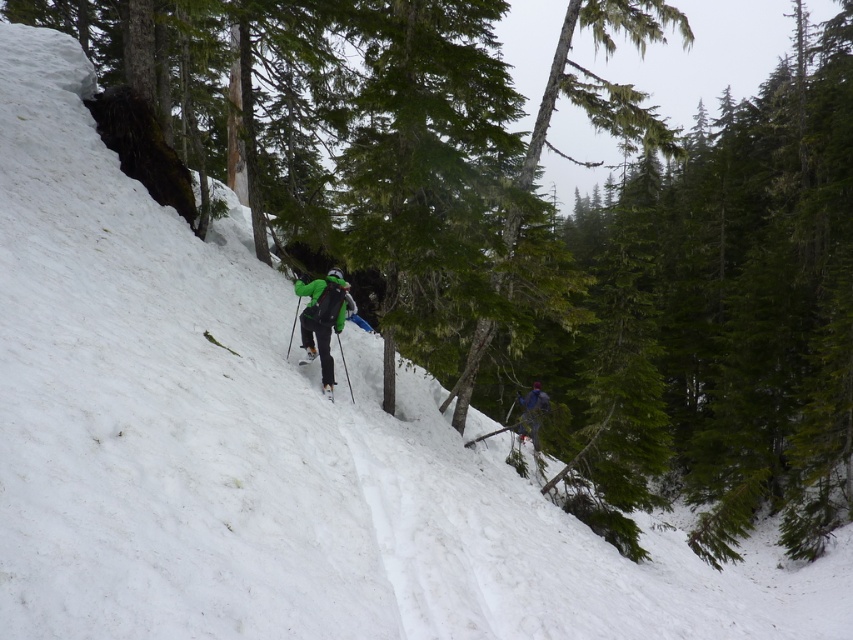
You are a photographer trying to capture a photo of both the blue fabric jacket at center and the green matte ski at center. Since you want them both in the frame, which object should you position closer to the center of your camera viewfinder to include both?

To include both the blue fabric jacket at center and the green matte ski at center in the frame, you should position the green matte ski at center closer to the center of your camera viewfinder since it is on the left side of the blue fabric jacket at center.